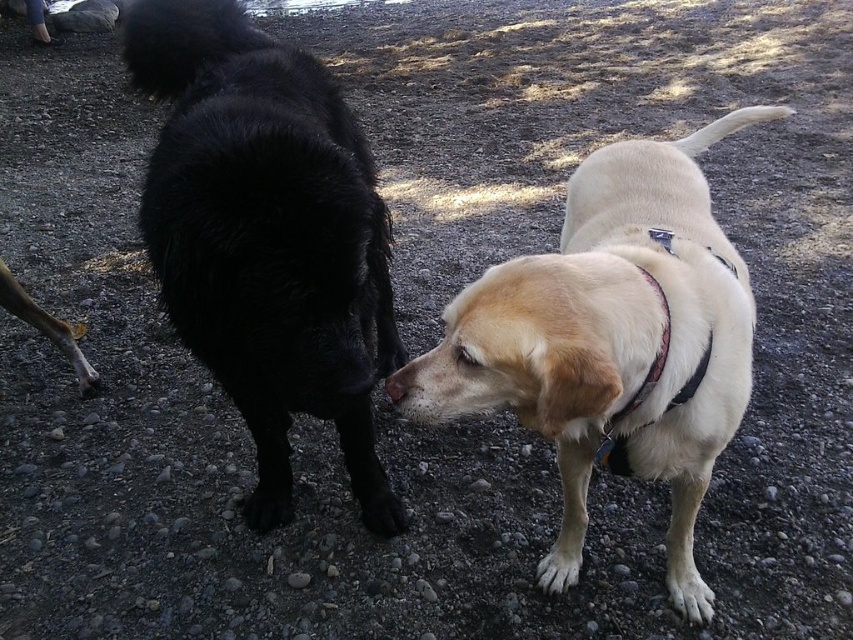
Can you confirm if multicolored fabric neckband at center is wider than brushed metal water at bottle left?

No, multicolored fabric neckband at center is not wider than brushed metal water at bottle left.

In order to click on multicolored fabric neckband at center in this screenshot , I will do `click(643, 378)`.

The width and height of the screenshot is (853, 640). In order to click on multicolored fabric neckband at center in this screenshot , I will do `click(643, 378)`.

Who is more forward, (625, 182) or (657, 369)?

Positioned in front is point (657, 369).

In the scene shown: Which is more to the right, light beige fur at center or multicolored fabric neckband at center?

light beige fur at center is more to the right.

Between point (683, 556) and point (662, 349), which one is positioned in front?

Point (662, 349) is more forward.

Find the location of a particular element. The height and width of the screenshot is (640, 853). light beige fur at center is located at coordinates (613, 340).

Does multicolored fabric neckband at center lie behind brown matte nose at center?

Yes, it is behind brown matte nose at center.

Who is more forward, (607, 452) or (392, 376)?

Positioned in front is point (392, 376).

The width and height of the screenshot is (853, 640). In order to click on multicolored fabric neckband at center in this screenshot , I will do `click(643, 378)`.